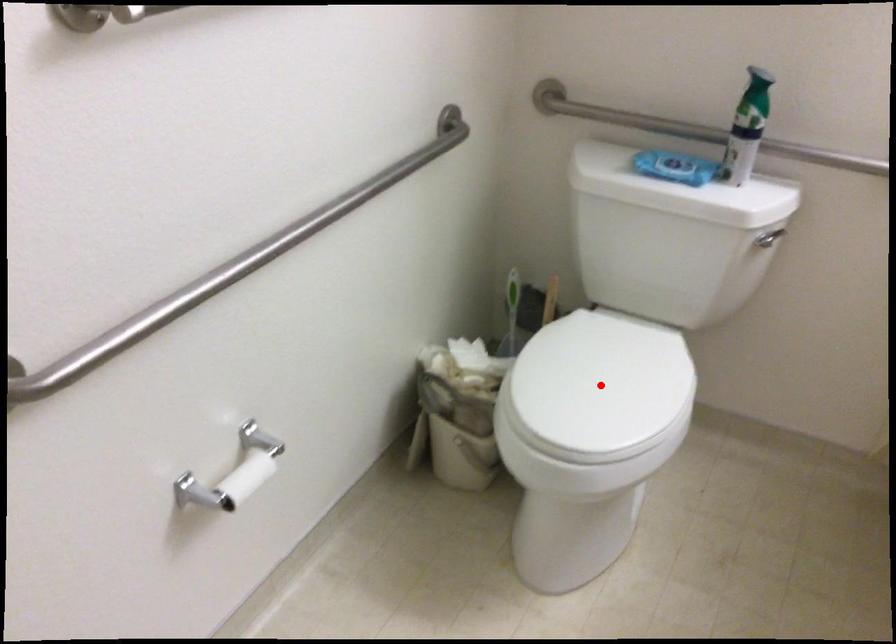
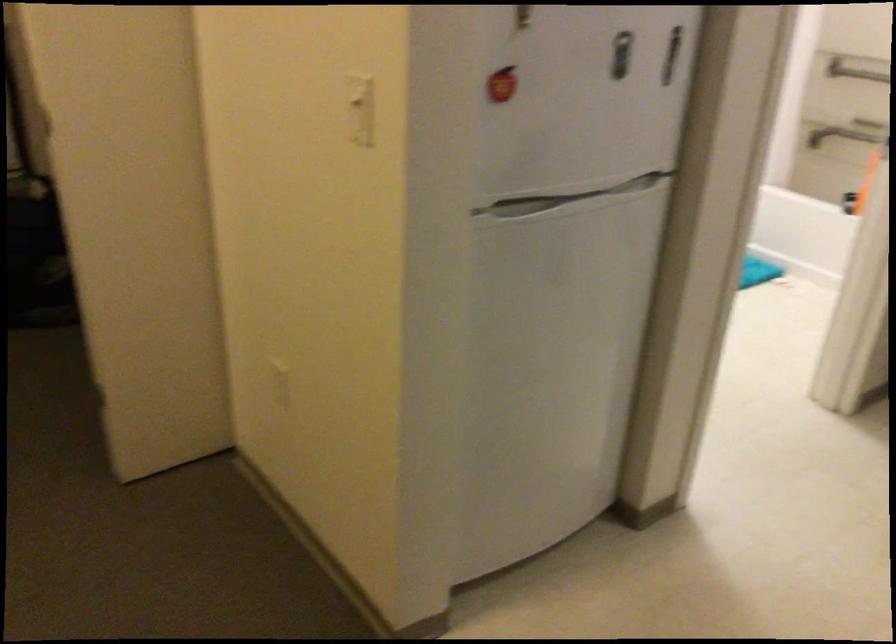
Question: I am providing you with two images of the same scene from different viewpoints. A red point is marked on the first image. Can you still see the location of the red point in image 2?

Choices:
 (A) Yes
 (B) No

Answer: (B)